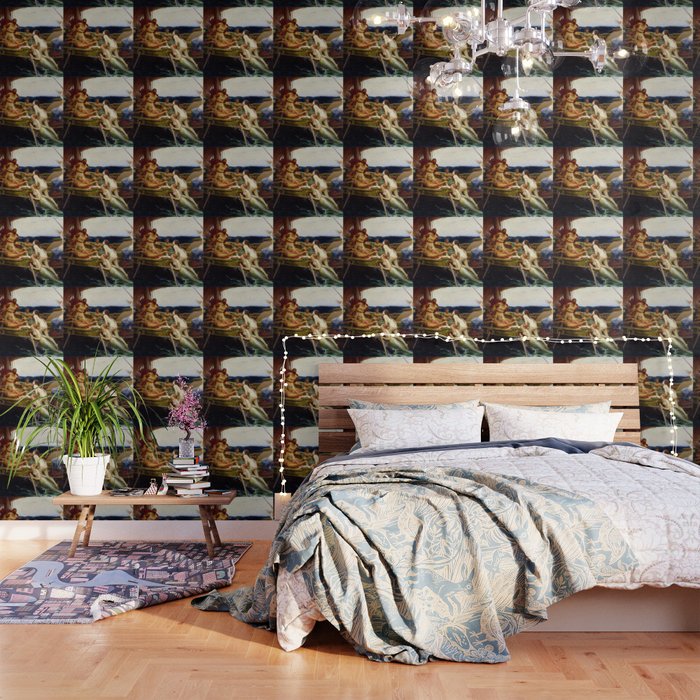
You are a GUI agent. You are given a task and a screenshot of the screen. Output one action in this format:
    pyautogui.click(x=<x>, y=<y>)
    Task: Click on the rug
    This screenshot has width=700, height=700.
    Given the screenshot: What is the action you would take?
    pyautogui.click(x=136, y=566)